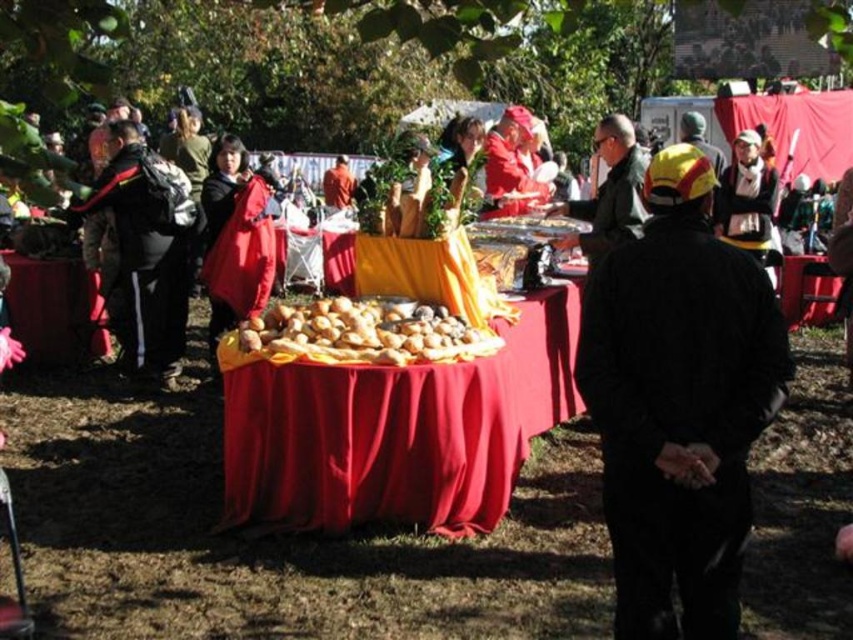
Can you confirm if brown matte nuts at center is bigger than matte black jacket at center?

Actually, brown matte nuts at center might be smaller than matte black jacket at center.

Between point (369, 355) and point (613, 122), which one is positioned behind?

Point (613, 122)

Identify the location of brown matte nuts at center. Image resolution: width=853 pixels, height=640 pixels. (363, 333).

Which is behind, point (329, 525) or point (497, 138)?

Positioned behind is point (497, 138).

Who is more forward, (479, 406) or (515, 156)?

Positioned in front is point (479, 406).

Where is `red cloth-covered table at center`? red cloth-covered table at center is located at coordinates (395, 429).

Is red cloth-covered table at center to the left of matte black jacket at center from the viewer's perspective?

Correct, you'll find red cloth-covered table at center to the left of matte black jacket at center.

Which of these two, red cloth-covered table at center or matte black jacket at center, stands shorter?

Standing shorter between the two is matte black jacket at center.

At what (x,y) coordinates should I click in order to perform the action: click on red cloth-covered table at center. Please return your answer as a coordinate pair (x, y). Looking at the image, I should click on (395, 429).